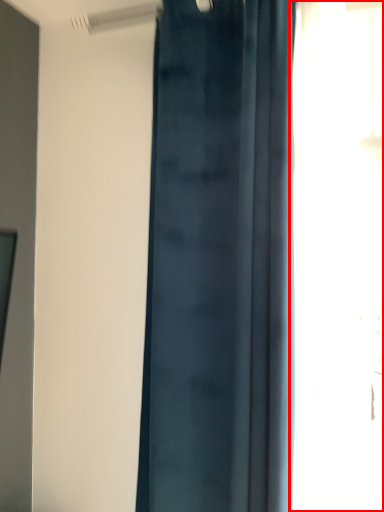
Question: From the image's perspective, what is the correct spatial relationship of window (annotated by the red box) in relation to curtain?

Choices:
 (A) below
 (B) above

Answer: (B)